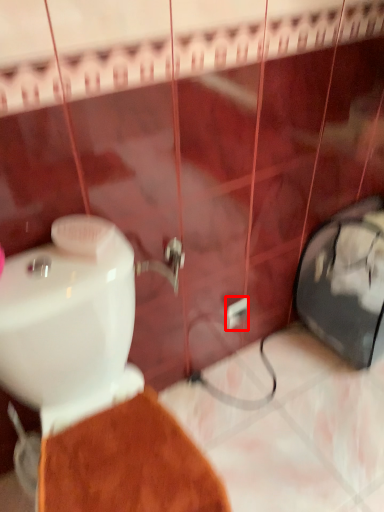
Question: From the image's perspective, what is the correct spatial positioning of electric outlet (annotated by the red box) in reference to toilet?

Choices:
 (A) below
 (B) above

Answer: (B)